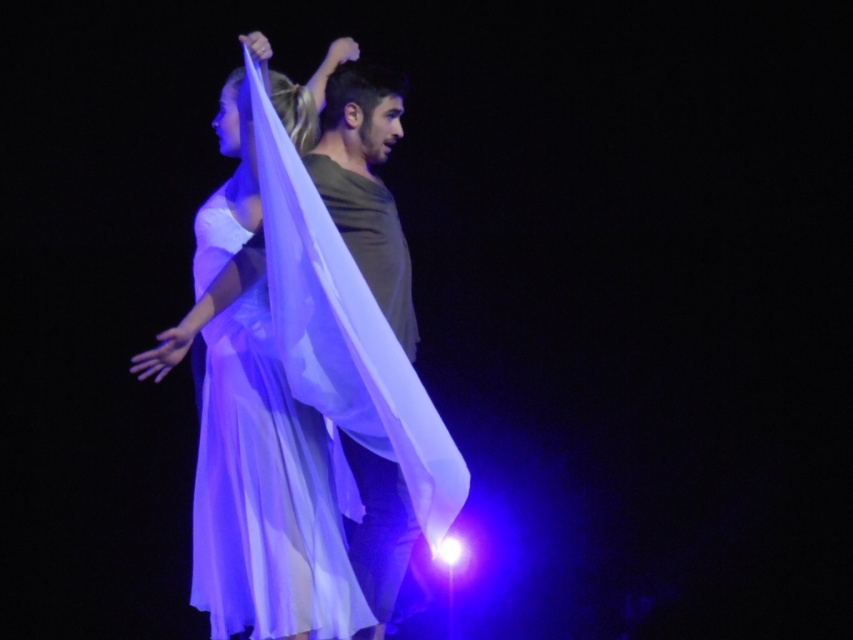
Is translucent white fabric at center to the right of translucent silk dress at center from the viewer's perspective?

Correct, you'll find translucent white fabric at center to the right of translucent silk dress at center.

This screenshot has height=640, width=853. In order to click on translucent white fabric at center in this screenshot , I will do [291, 388].

Locate an element on the screen. The image size is (853, 640). translucent white fabric at center is located at coordinates (291, 388).